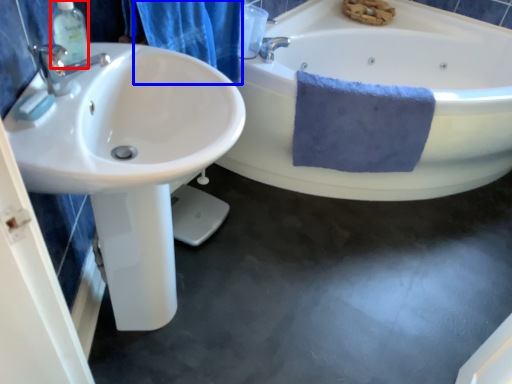
Question: Which object appears closest to the camera in this image, soap dispenser (highlighted by a red box) or shower curtain (highlighted by a blue box)?

Choices:
 (A) soap dispenser
 (B) shower curtain

Answer: (A)